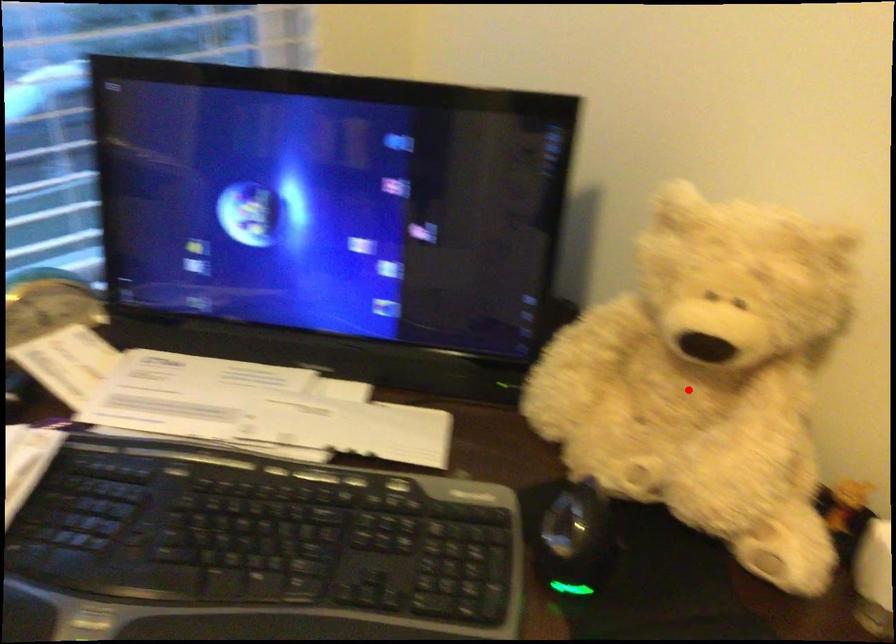
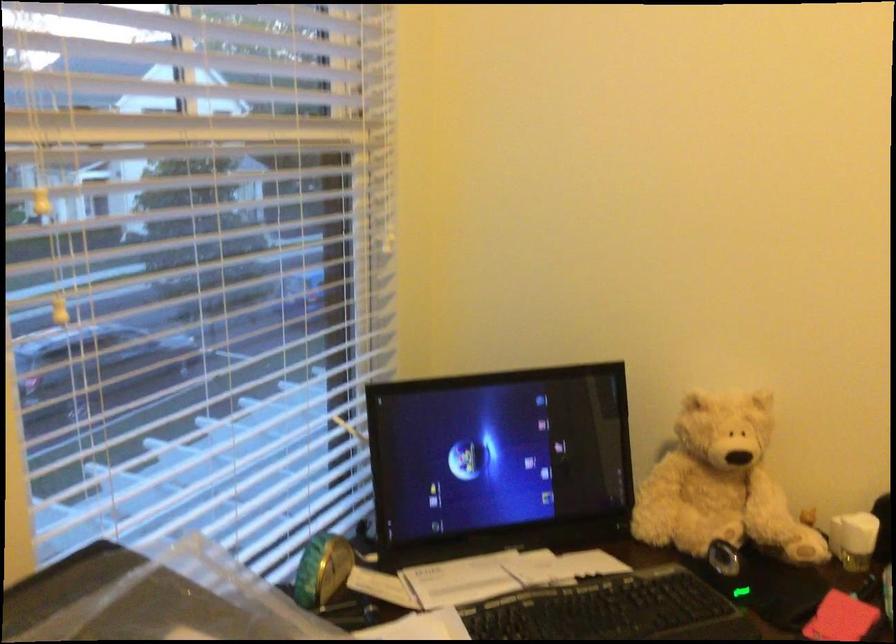
Question: I am providing you with two images of the same scene from different viewpoints. Given a red point in image1, look at the same physical point in image2. Is it:

Choices:
 (A) Closer to the viewpoint
 (B) Farther from the viewpoint

Answer: (B)